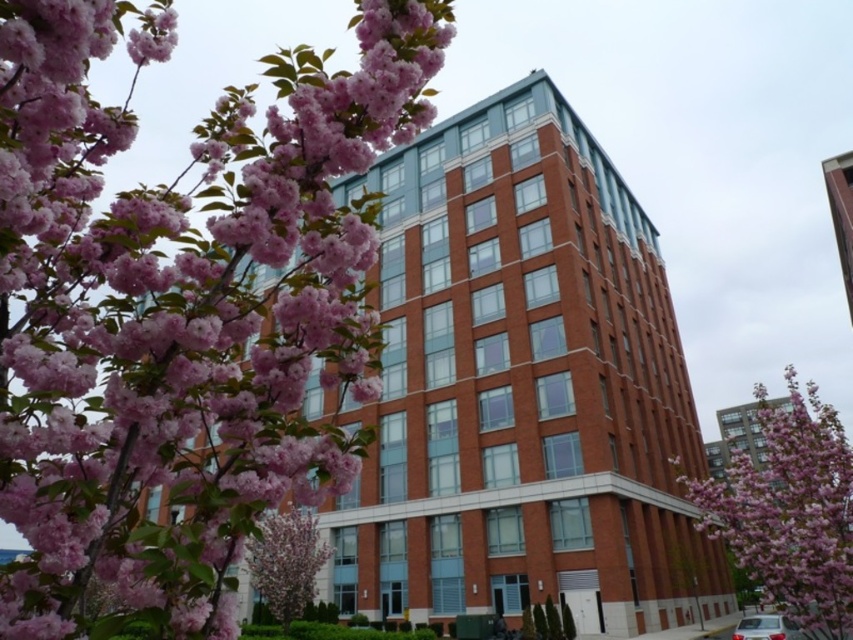
Who is more distant from viewer, (21, 524) or (758, 472)?

The point (758, 472) is more distant.

Between pink matte blossoms at upper left and pink bloom at center, which one is positioned lower?

pink bloom at center is below.

At what (x,y) coordinates should I click in order to perform the action: click on pink matte blossoms at upper left. Please return your answer as a coordinate pair (x, y). The width and height of the screenshot is (853, 640). Looking at the image, I should click on (180, 310).

Which of these two, pink matte blossoms at upper left or pink bloom tree at lower left, stands taller?

Standing taller between the two is pink matte blossoms at upper left.

Between pink matte blossoms at upper left and pink bloom tree at lower left, which one is positioned lower?

pink bloom tree at lower left

Between point (57, 134) and point (280, 614), which one is positioned in front?

Point (57, 134)

At what (x,y) coordinates should I click in order to perform the action: click on pink matte blossoms at upper left. Please return your answer as a coordinate pair (x, y). Image resolution: width=853 pixels, height=640 pixels. Looking at the image, I should click on (x=180, y=310).

Which is more to the left, pink bloom at center or pink bloom tree at lower left?

From the viewer's perspective, pink bloom tree at lower left appears more on the left side.

Who is lower down, pink bloom at center or pink bloom tree at lower left?

pink bloom at center is lower down.

Is point (676, 468) in front of point (288, 528)?

That is False.

Where is `pink bloom at center`? Image resolution: width=853 pixels, height=640 pixels. pink bloom at center is located at coordinates (788, 509).